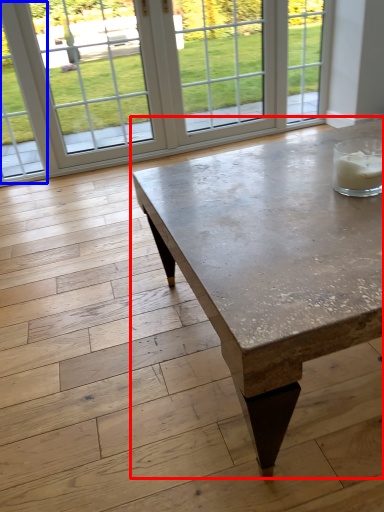
Question: Which object appears closest to the camera in this image, coffee table (highlighted by a red box) or window (highlighted by a blue box)?

Choices:
 (A) coffee table
 (B) window

Answer: (A)